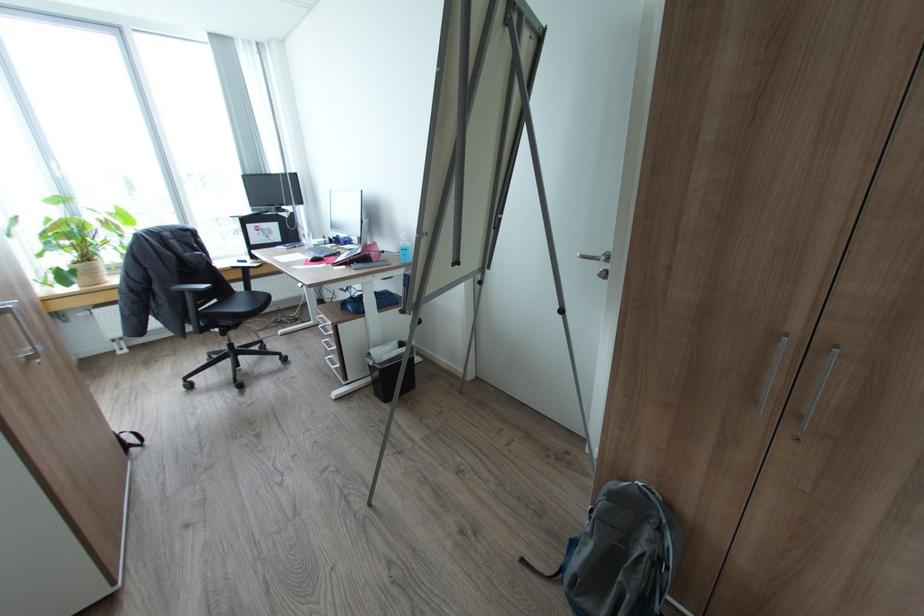
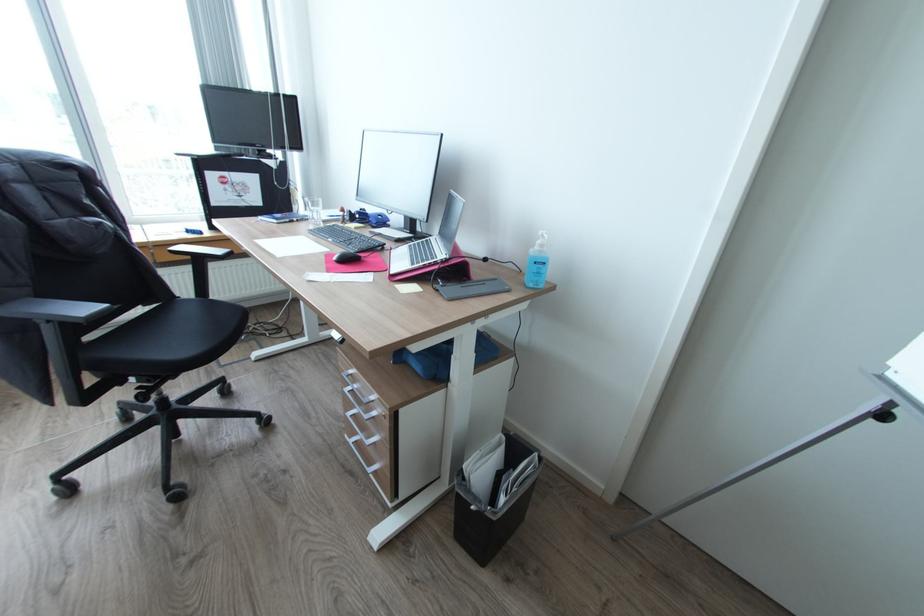
In the second image, find the point that corresponds to (338,365) in the first image.

(373, 464)